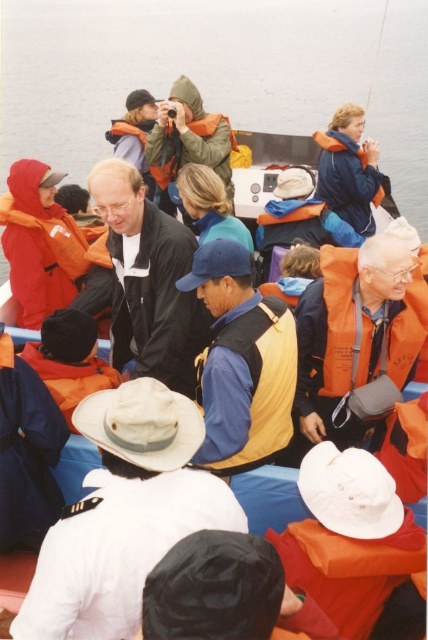
Question: Is matte black jacket at center closer to camera compared to yellow matte life jacket at center?

Choices:
 (A) yes
 (B) no

Answer: (B)

Question: Which object is the farthest from the orange fabric life jacket at right?

Choices:
 (A) orange/yellow fabric life jacket at lower center
 (B) orange life jacket at lower left
 (C) yellow matte life jacket at center

Answer: (B)

Question: Which point appears closest to the camera in this image?

Choices:
 (A) (413, 358)
 (B) (410, 305)
 (C) (279, 547)

Answer: (C)

Question: Does yellow matte life jacket at center appear on the left side of blue fleece life jacket at upper right?

Choices:
 (A) yes
 (B) no

Answer: (A)

Question: Which object appears farthest from the camera in this image?

Choices:
 (A) orange/yellow fabric life jacket at lower center
 (B) orange matte life jacket at center

Answer: (B)

Question: Considering the relative positions of white matte hat at center and matte black jacket at center in the image provided, where is white matte hat at center located with respect to matte black jacket at center?

Choices:
 (A) right
 (B) left

Answer: (A)